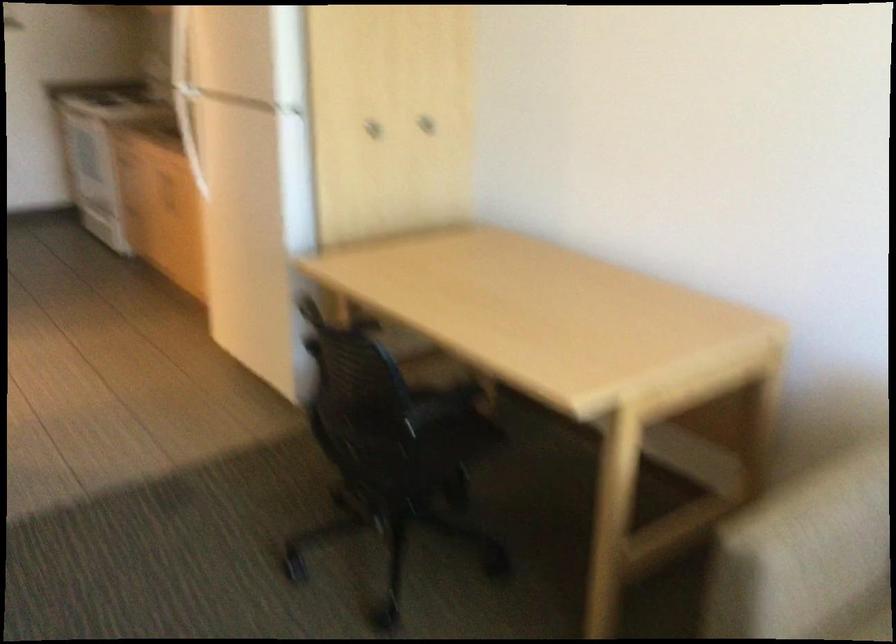
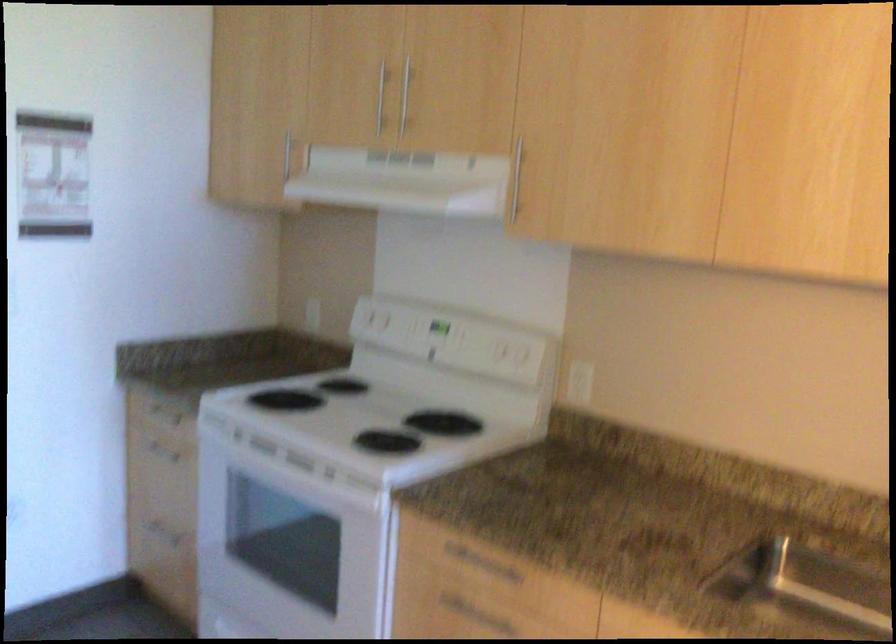
The point at [151,102] is marked in the first image. Where is the corresponding point in the second image?

(367, 415)